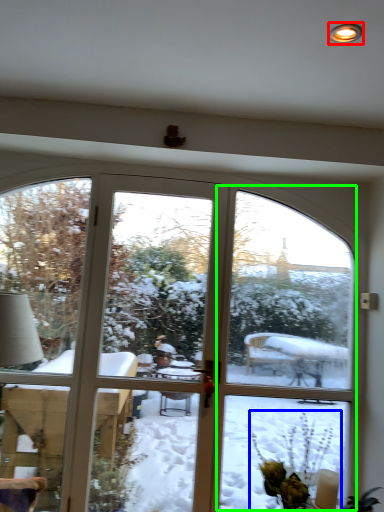
Question: Considering the real-world distances, which object is farthest from light (highlighted by a red box)? floral arrangement (highlighted by a blue box) or screen door (highlighted by a green box)?

Choices:
 (A) floral arrangement
 (B) screen door

Answer: (B)